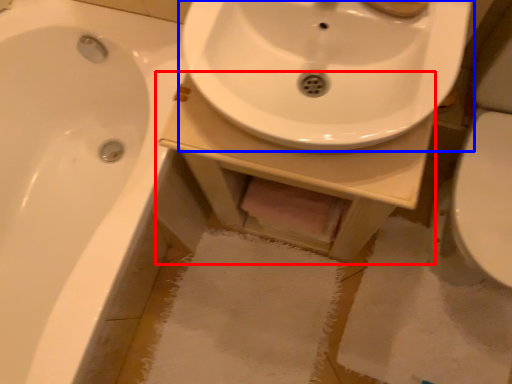
Question: Which point is further to the camera, counter top (highlighted by a red box) or sink (highlighted by a blue box)?

Choices:
 (A) counter top
 (B) sink

Answer: (A)